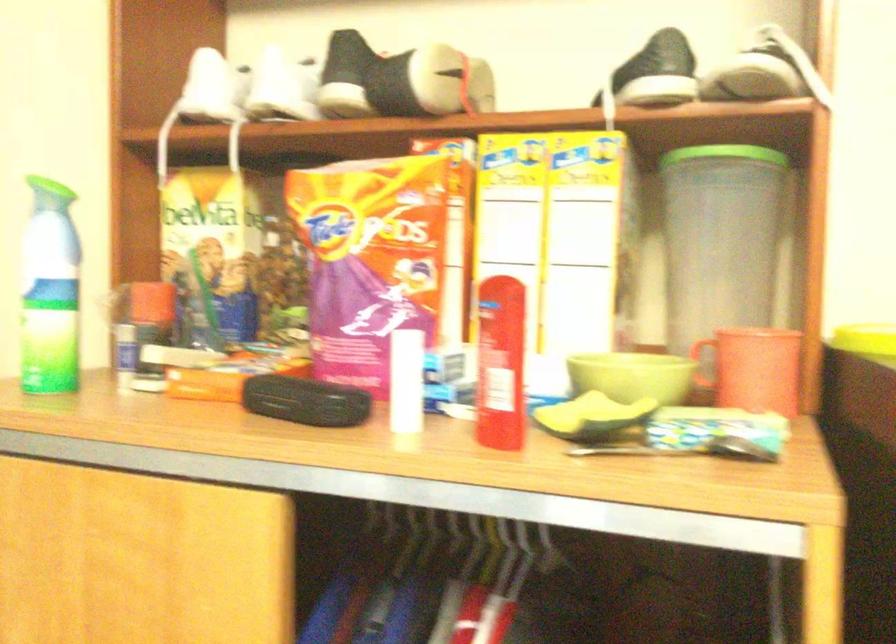
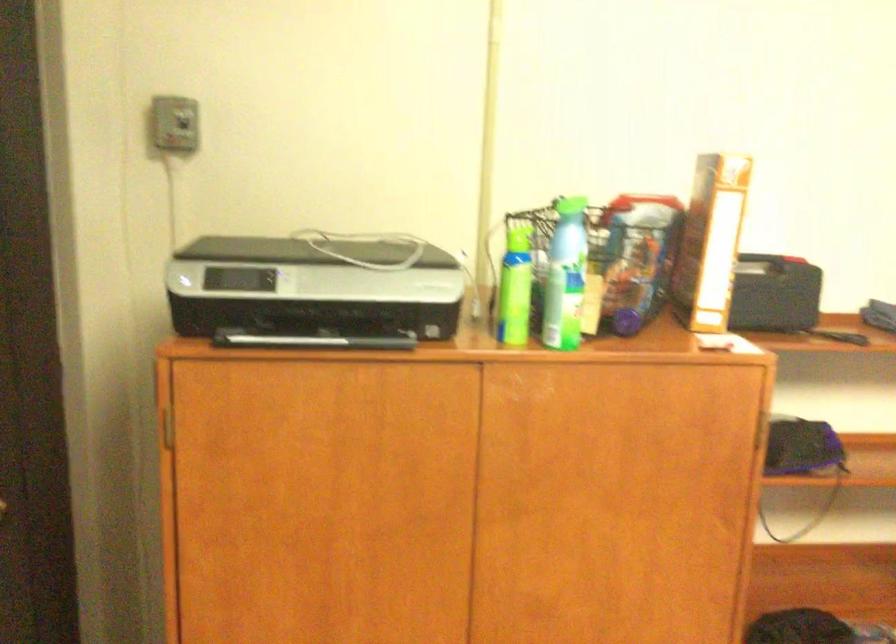
Question: The camera is either moving clockwise (left) or counter-clockwise (right) around the object. The first image is from the beginning of the video and the second image is from the end. Is the camera moving left or right when shooting the video?

Choices:
 (A) Left
 (B) Right

Answer: (A)